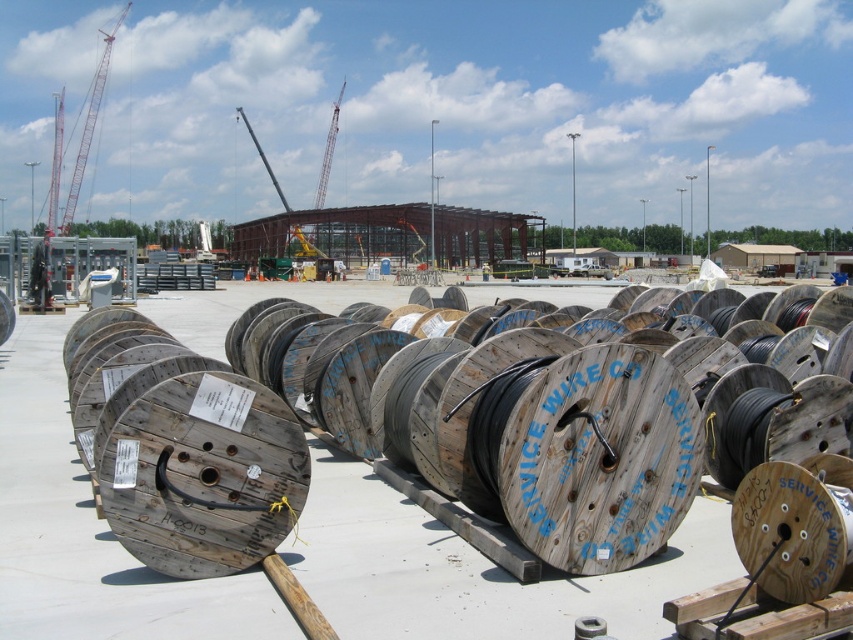
Question: Can you confirm if wooden spools of wire at center is positioned to the left of red metal crane at upper left?

Choices:
 (A) yes
 (B) no

Answer: (B)

Question: Based on their relative distances, which object is nearer to the red metal crane at upper left?

Choices:
 (A) wooden spools of wire at center
 (B) wooden spool at center

Answer: (A)

Question: Does wooden spool at center appear on the left side of red metal crane at upper left?

Choices:
 (A) no
 (B) yes

Answer: (A)

Question: Which point is closer to the camera taking this photo?

Choices:
 (A) (672, 417)
 (B) (496, 554)
 (C) (88, 147)

Answer: (A)

Question: Can you confirm if wooden spool at center is wider than wooden spools of wire at center?

Choices:
 (A) yes
 (B) no

Answer: (B)

Question: Which point appears closest to the camera in this image?

Choices:
 (A) (97, 84)
 (B) (663, 394)
 (C) (10, 602)

Answer: (C)